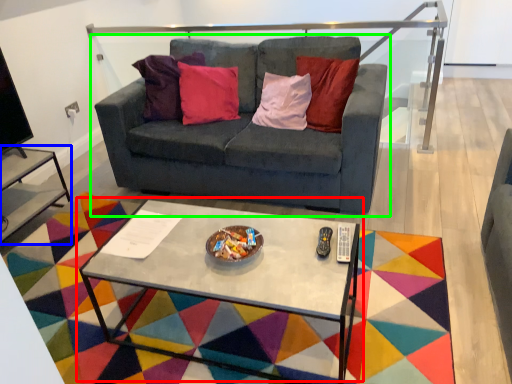
Question: Estimate the real-world distances between objects in this image. Which object is closer to coffee table (highlighted by a red box), side table (highlighted by a blue box) or studio couch (highlighted by a green box)?

Choices:
 (A) side table
 (B) studio couch

Answer: (B)